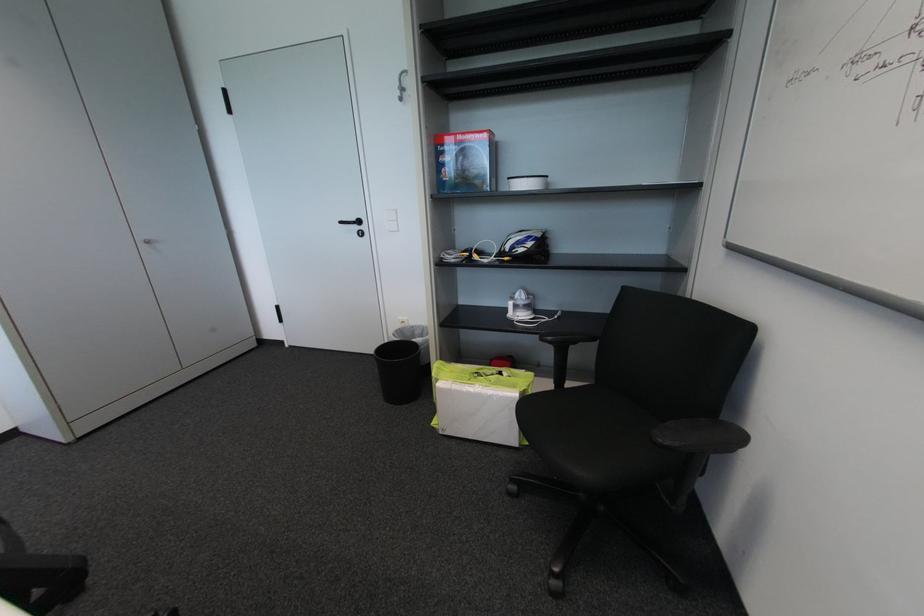
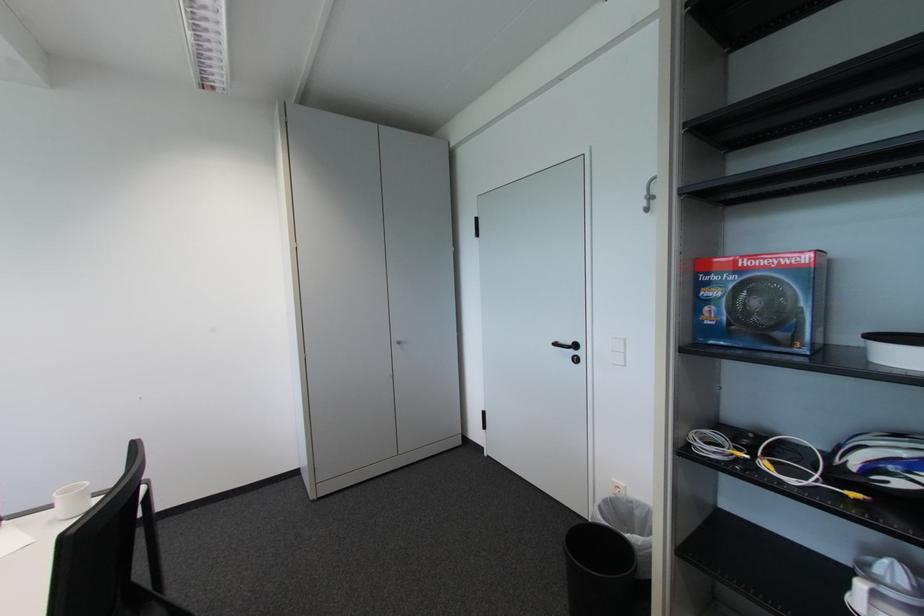
Question: The camera is either moving clockwise (left) or counter-clockwise (right) around the object. The first image is from the beginning of the video and the second image is from the end. Is the camera moving left or right when shooting the video?

Choices:
 (A) Left
 (B) Right

Answer: (B)